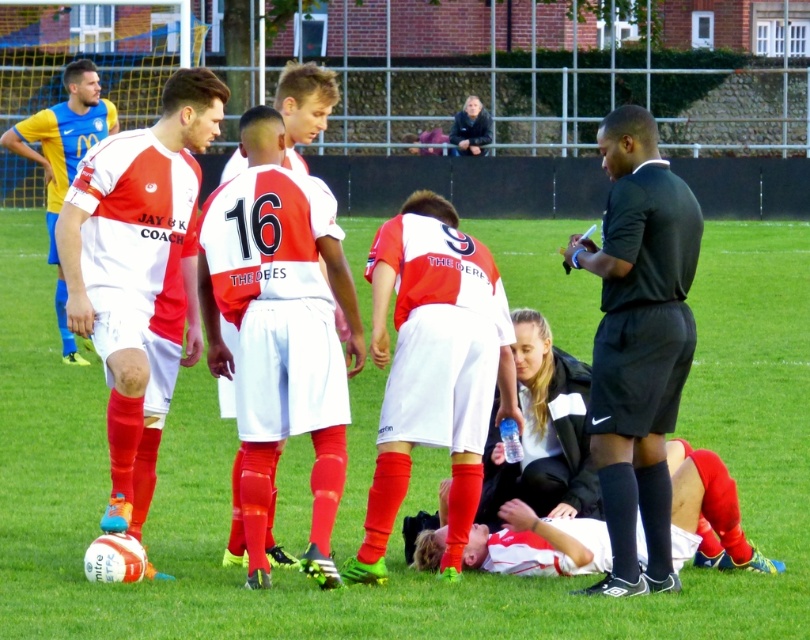
In the scene shown: Is green grass at center to the right of black smooth shirt at right from the viewer's perspective?

No, green grass at center is not to the right of black smooth shirt at right.

Where is `green grass at center`? The width and height of the screenshot is (810, 640). green grass at center is located at coordinates (408, 490).

Where is `green grass at center`? green grass at center is located at coordinates (408, 490).